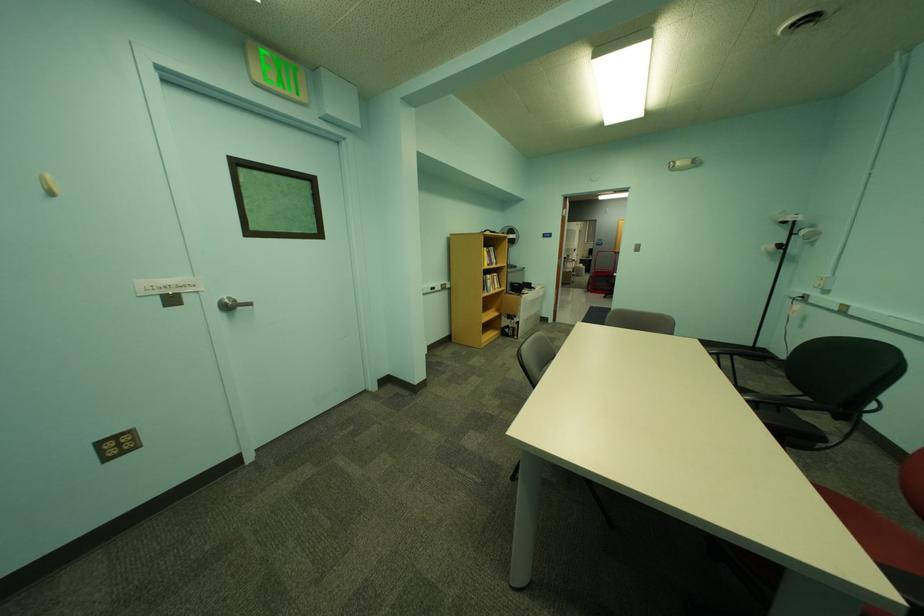
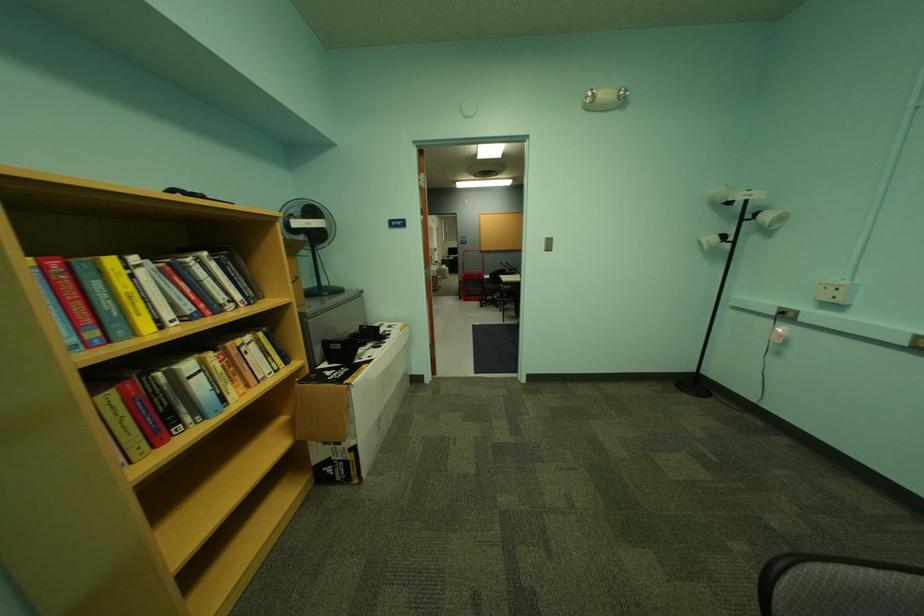
Locate, in the second image, the point that corresponds to the point at 801,309 in the first image.

(783, 330)